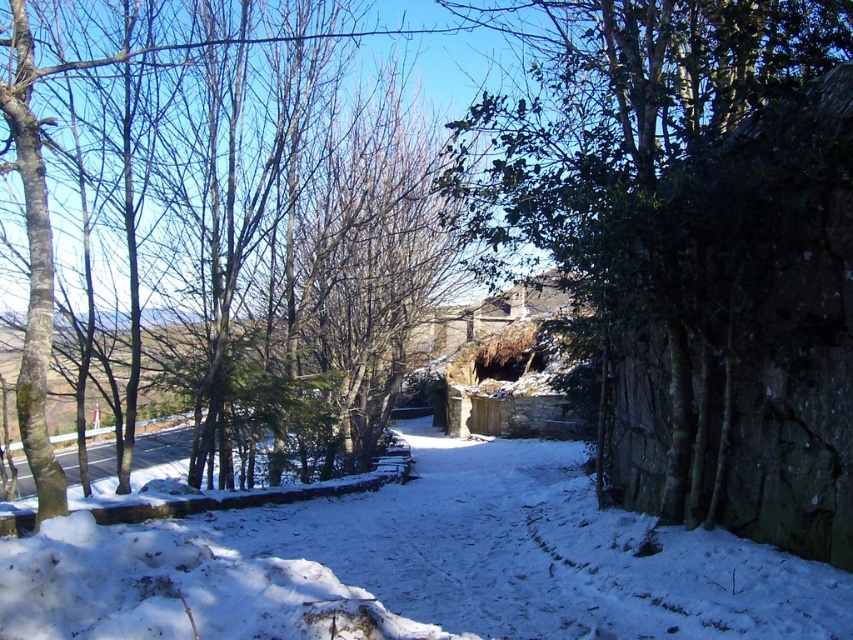
You are standing at the edge of the snow path and want to walk towards the brown bark tree at left. Which direction should you walk to avoid stepping on the white powdery snow at center?

To avoid stepping on the white powdery snow at center, you should walk towards the brown bark tree at left along the path that is not covered by the snow. However, according to the scene description, the entire ground is snow covered except for faint tracks, so it might be challenging to avoid stepping on snow entirely. But since the white powdery snow at center is in front of the tree, walking directly towards the tree would mean moving through the snow towards it. Alternatively, if the path winds around,